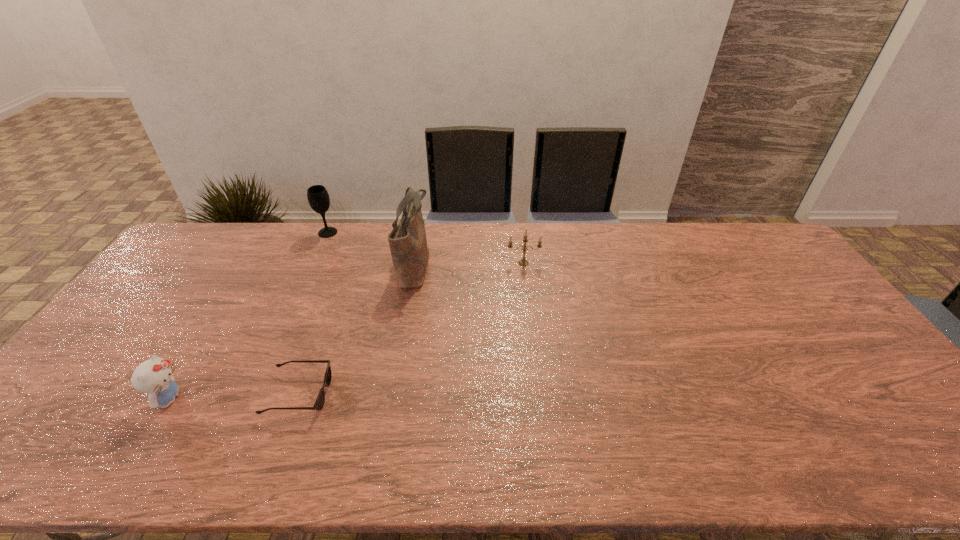
The image size is (960, 540). What are the coordinates of `the fourth object from left to right` in the screenshot? It's located at tap(408, 244).

Identify the location of shoulder bag. (408, 244).

Where is `wineglass`? This screenshot has width=960, height=540. wineglass is located at coordinates (317, 195).

The image size is (960, 540). Find the location of `the fourth shortest object`. the fourth shortest object is located at coordinates (317, 195).

At what (x,y) coordinates should I click in order to perform the action: click on candle. Please return your answer as a coordinate pair (x, y). Looking at the image, I should click on (522, 262).

At what (x,y) coordinates should I click in order to perform the action: click on the leftmost object. Please return your answer as a coordinate pair (x, y). This screenshot has height=540, width=960. Looking at the image, I should click on pos(153,376).

This screenshot has height=540, width=960. What are the coordinates of `the shortest object` in the screenshot? It's located at (319, 403).

Image resolution: width=960 pixels, height=540 pixels. I want to click on blank space located on the front-facing side of the shoulder bag, so click(523, 265).

Where is `vacant point located on the left of the second tallest object`? The width and height of the screenshot is (960, 540). vacant point located on the left of the second tallest object is located at coordinates (255, 233).

This screenshot has height=540, width=960. Find the location of `free space located on the front of the rightmost object`. free space located on the front of the rightmost object is located at coordinates (534, 350).